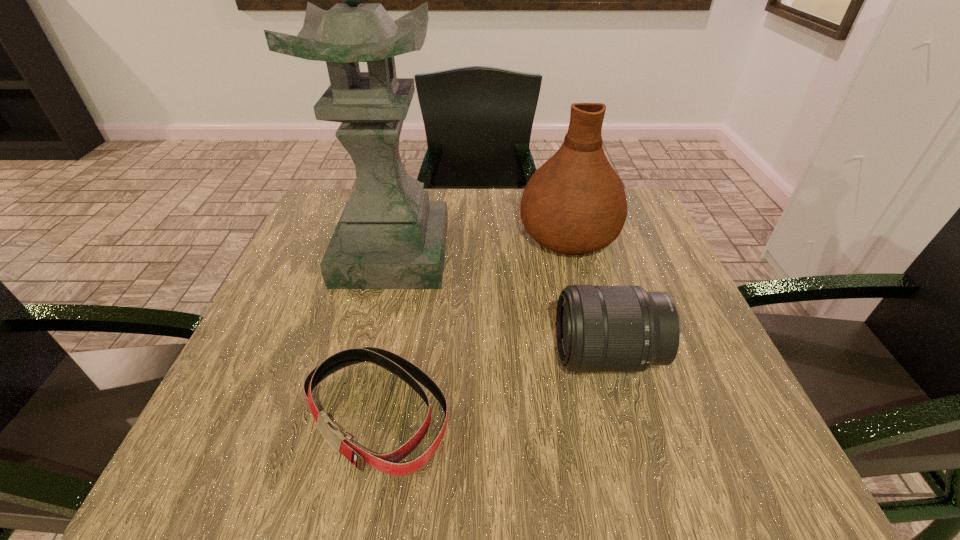
Locate an element on the screen. The image size is (960, 540). empty space between the tallest object and the pitcher is located at coordinates (480, 245).

Where is `vacant area that lies between the telephoto lens and the dog collar`? vacant area that lies between the telephoto lens and the dog collar is located at coordinates (492, 385).

The height and width of the screenshot is (540, 960). Identify the location of vacant area between the pitcher and the shortest object. (472, 325).

Select which object appears as the closest to the telephoto lens. Please provide its 2D coordinates. Your answer should be formatted as a tuple, i.e. [(x, y)], where the tuple contains the x and y coordinates of a point satisfying the conditions above.

[(575, 203)]

Locate which object is the third closest to the shortest object. Please provide its 2D coordinates. Your answer should be formatted as a tuple, i.e. [(x, y)], where the tuple contains the x and y coordinates of a point satisfying the conditions above.

[(575, 203)]

Identify the location of vacant space that satisfies the following two spatial constraints: 1. at the front opening of the dog collar; 2. on the right side of the tallest object. The height and width of the screenshot is (540, 960). (354, 414).

Where is `free location that satisfies the following two spatial constraints: 1. at the front opening of the shortest object; 2. on the left side of the sculpture`? Image resolution: width=960 pixels, height=540 pixels. free location that satisfies the following two spatial constraints: 1. at the front opening of the shortest object; 2. on the left side of the sculpture is located at coordinates (354, 414).

Locate an element on the screen. vacant space that satisfies the following two spatial constraints: 1. at the front opening of the tallest object; 2. on the right side of the shortest object is located at coordinates (354, 414).